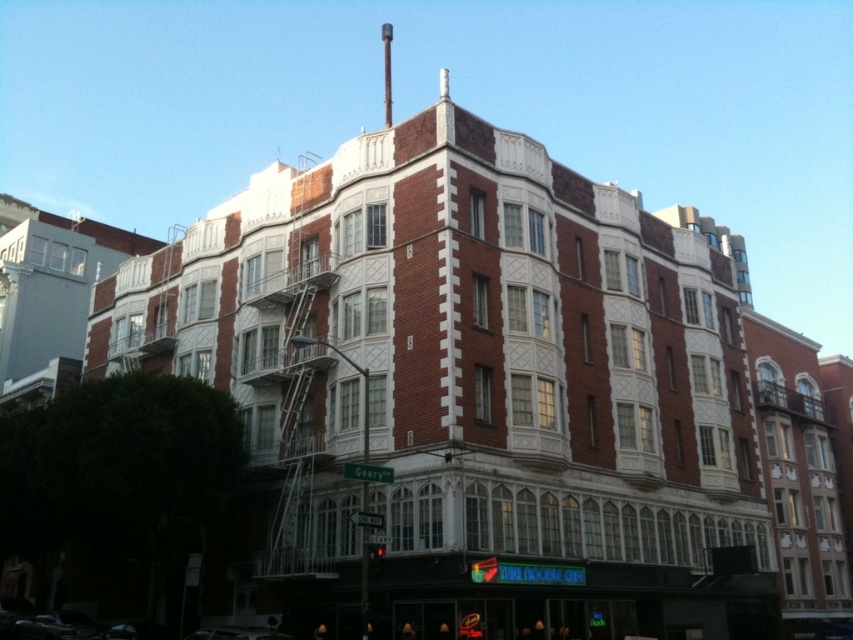
Is red brick building at center bigger than shiny silver car at lower left?

Yes, red brick building at center is bigger than shiny silver car at lower left.

Measure the distance from red brick building at center to shiny silver car at lower left.

red brick building at center and shiny silver car at lower left are 202.39 feet apart from each other.

What are the coordinates of `red brick building at center` in the screenshot? It's located at (805, 472).

Between point (744, 445) and point (799, 454), which one is positioned behind?

Positioned behind is point (799, 454).

Which is in front, point (467, 480) or point (802, 563)?

Point (467, 480) is in front.

Where is `brick building at center`? Image resolution: width=853 pixels, height=640 pixels. brick building at center is located at coordinates (463, 394).

Identify the location of brick building at center. The height and width of the screenshot is (640, 853). (463, 394).

Is brick building at center positioned at the back of shiny silver car at lower left?

No.

Is brick building at center shorter than shiny silver car at lower left?

In fact, brick building at center may be taller than shiny silver car at lower left.

The image size is (853, 640). I want to click on brick building at center, so click(463, 394).